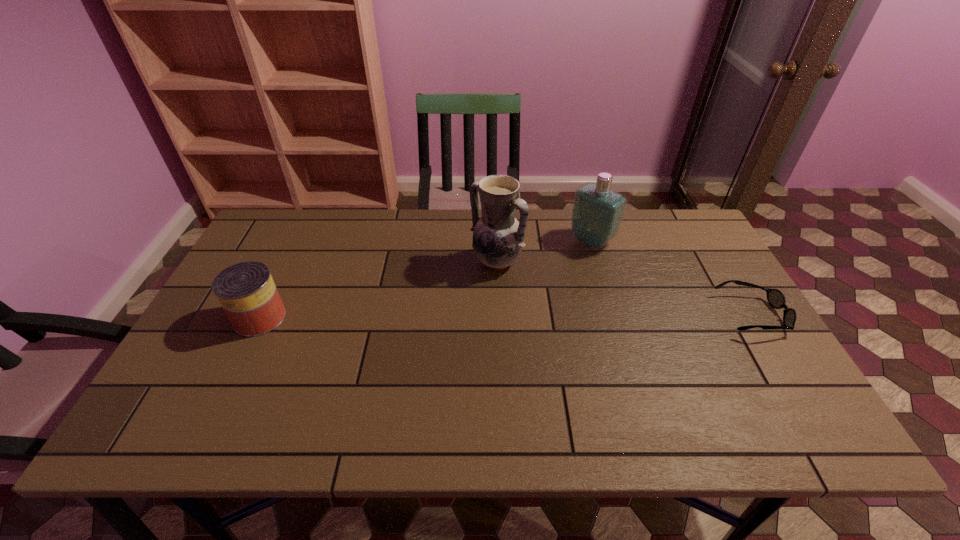
Locate an element on the screen. Image resolution: width=960 pixels, height=540 pixels. vacant area that lies between the third object from right to left and the sunglasses is located at coordinates (624, 288).

You are a GUI agent. You are given a task and a screenshot of the screen. Output one action in this format:
    pyautogui.click(x=<x>, y=<y>)
    Task: Click on the unoccupied position between the leftmost object and the third object from right to left
    
    Given the screenshot: What is the action you would take?
    tap(378, 290)

At what (x,y) coordinates should I click in order to perform the action: click on vacant area that lies between the pottery and the can. Please return your answer as a coordinate pair (x, y). Looking at the image, I should click on (378, 290).

Identify which object is located as the second nearest to the leftmost object. Please provide its 2D coordinates. Your answer should be formatted as a tuple, i.e. [(x, y)], where the tuple contains the x and y coordinates of a point satisfying the conditions above.

[(597, 213)]

This screenshot has height=540, width=960. I want to click on the third closest object to the can, so click(775, 297).

Image resolution: width=960 pixels, height=540 pixels. Identify the location of free spot that satisfies the following two spatial constraints: 1. on the back side of the sunglasses; 2. on the lenses of the third tallest object. (261, 315).

At what (x,y) coordinates should I click in order to perform the action: click on vacant space that satisfies the following two spatial constraints: 1. on the front side of the third object from right to left; 2. on the lenses of the rightmost object. Please return your answer as a coordinate pair (x, y). The image size is (960, 540). Looking at the image, I should click on (498, 315).

The height and width of the screenshot is (540, 960). I want to click on free region that satisfies the following two spatial constraints: 1. on the front side of the third object from right to left; 2. on the lenses of the rightmost object, so click(x=498, y=315).

Locate an element on the screen. The width and height of the screenshot is (960, 540). free space that satisfies the following two spatial constraints: 1. on the front side of the second object from left to right; 2. on the lenses of the shortest object is located at coordinates tap(498, 315).

At what (x,y) coordinates should I click in order to perform the action: click on vacant space that satisfies the following two spatial constraints: 1. on the back side of the third tallest object; 2. on the left side of the third object from right to left. Please return your answer as a coordinate pair (x, y). Looking at the image, I should click on (287, 262).